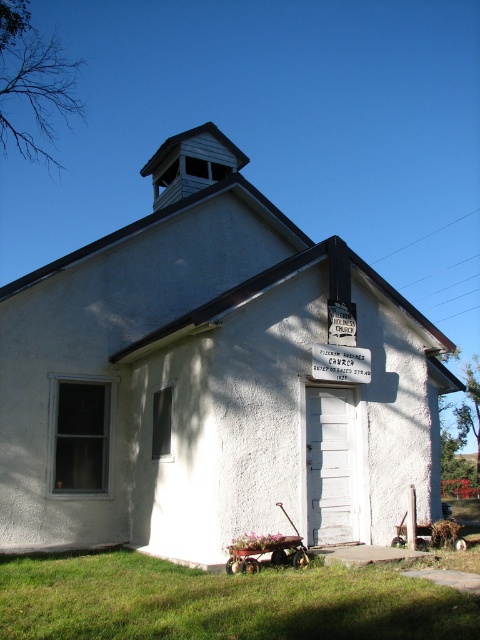
You are standing at the entrance of the park and want to find the white stucco church at center. According to the map, your current position is at point A, and the church is marked at point B. What direction should you head to reach the church?

The white stucco church at center is located at point B, so you should head towards point B from point A to reach it.

You are standing in front of the Pilgrim Holiness Church and want to determine the relative positions of two points marked on the church facade. The first point is at coordinate point (x=40, y=493) and the second is at point (x=352, y=372). Which point is closer to you?

Point (x=40, y=493) is closer to you because it is further to the viewer than point (x=352, y=372).

You are standing in front of the white stucco church at center and want to read the white plastic sign at center above its door. Can you easily read the text on the sign without moving closer?

The white stucco church at center is closer to the viewer than the white plastic sign at center, so the sign is further away. Since the sign is positioned above the door of the church, you would need to move closer to read the text clearly.